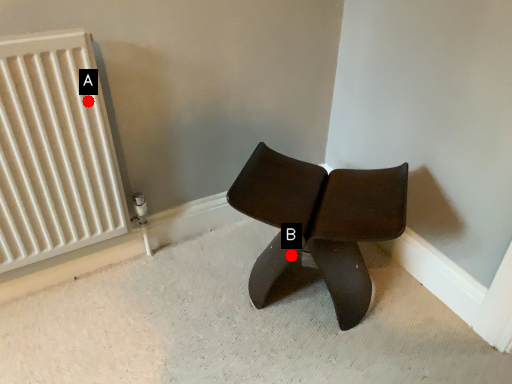
Question: Two points are circled on the image, labeled by A and B beside each circle. Which point is farther from the camera taking this photo?

Choices:
 (A) A is further
 (B) B is further

Answer: (B)